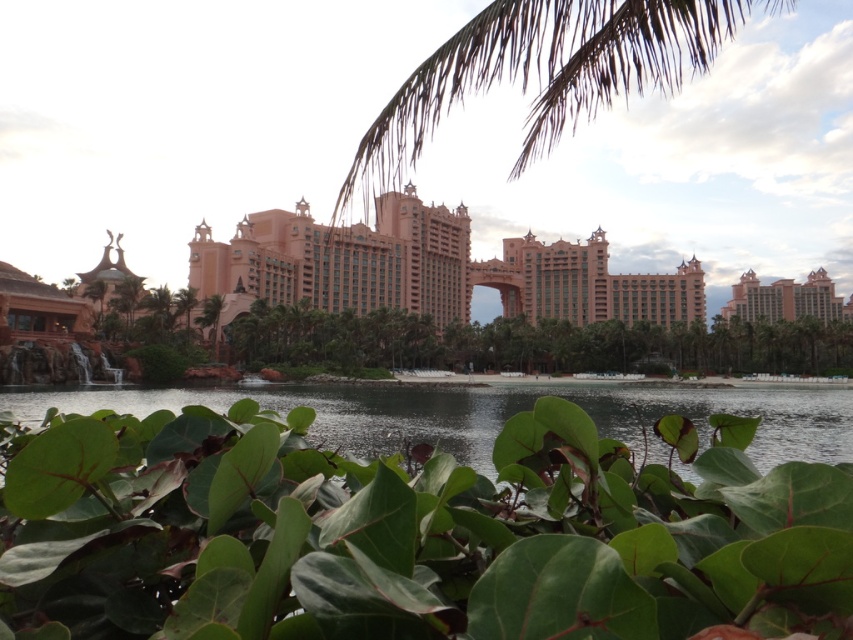
You are a landscape designer planning to install a new pathway between the green matte leaves at lower center and the transparent water at center. Which object should the pathway start closer to to ensure it aligns with their current positions?

The pathway should start closer to the green matte leaves at lower center because it is positioned on the left side of the transparent water at center, so the pathway should begin near its current left position to align with their arrangement.